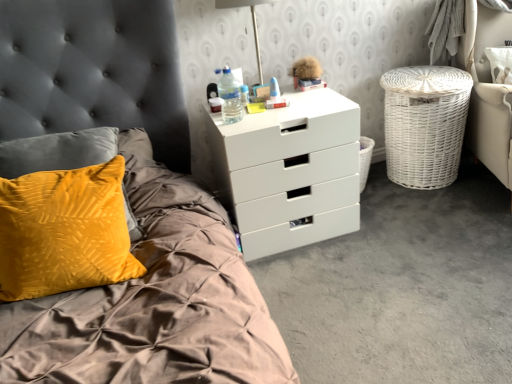
This screenshot has height=384, width=512. What are the coordinates of `empty space that is in between white wicker armchair at right and white wicker laundry basket at right` in the screenshot? It's located at click(446, 202).